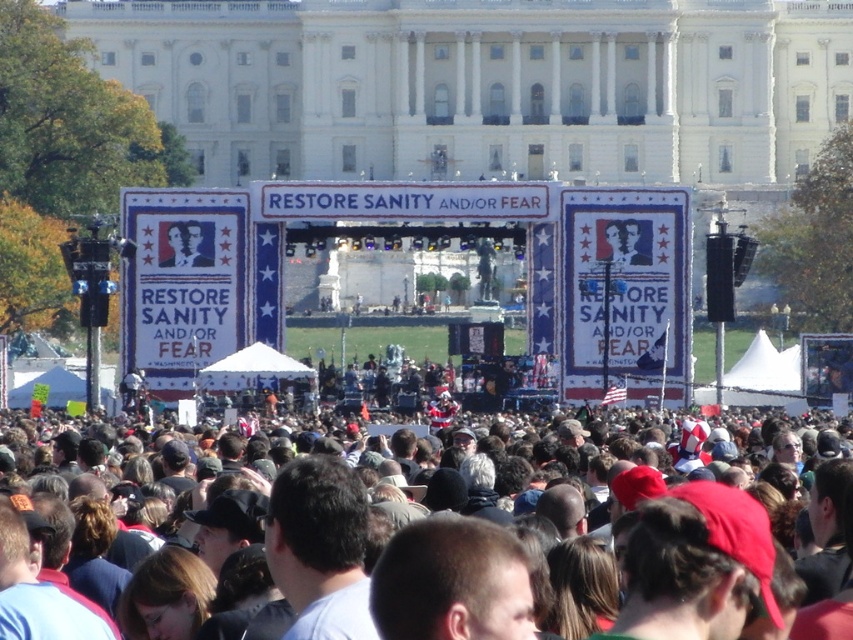
Is dark brown hair at center below matte black portrait at center?

Yes, dark brown hair at center is below matte black portrait at center.

Does dark brown hair at center have a lesser height compared to matte black portrait at center?

Incorrect, dark brown hair at center's height does not fall short of matte black portrait at center's.

Who is more distant from viewer, (456, 493) or (175, 241)?

Positioned behind is point (175, 241).

I want to click on dark brown hair at center, so click(x=779, y=477).